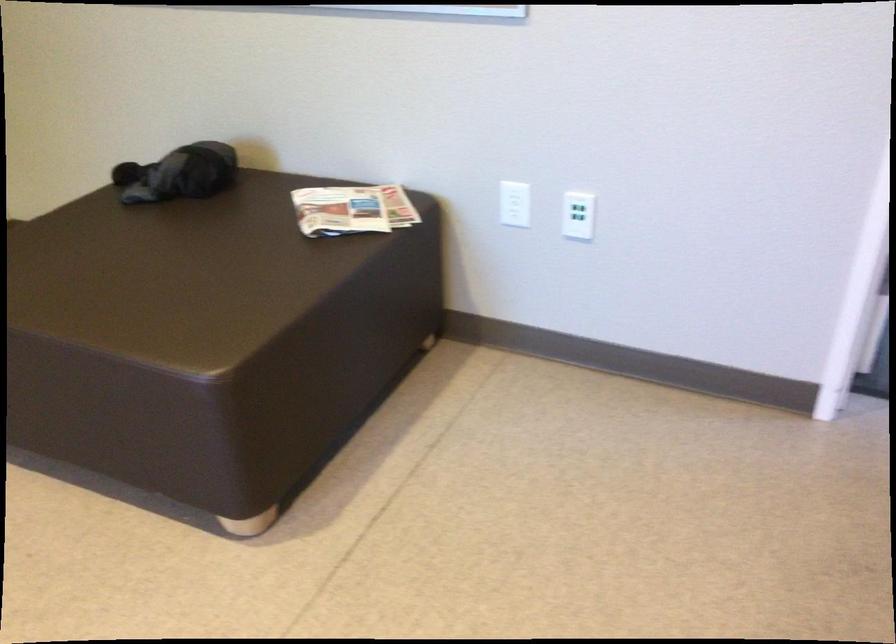
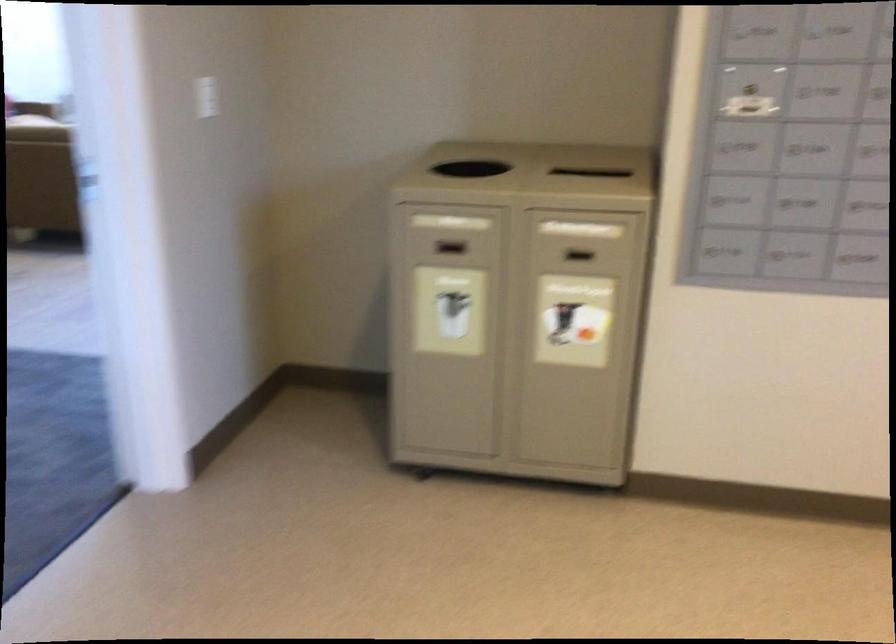
The images are taken continuously from a first-person perspective. In which direction is your viewpoint rotating?

The camera rotated toward right-down.